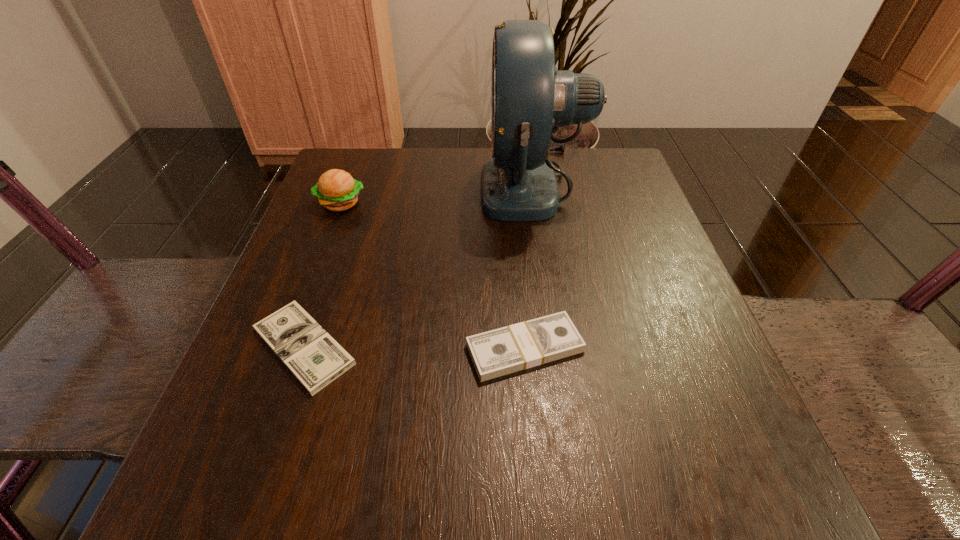
The height and width of the screenshot is (540, 960). I want to click on free region located 0.080m on the left of the right dollar, so click(415, 348).

Locate an element on the screen. Image resolution: width=960 pixels, height=540 pixels. vacant point located on the front of the left dollar is located at coordinates (248, 508).

Image resolution: width=960 pixels, height=540 pixels. What are the coordinates of `fan that is at the far edge` in the screenshot? It's located at (530, 98).

Where is `hamburger located at the far edge`? The height and width of the screenshot is (540, 960). hamburger located at the far edge is located at coordinates (336, 190).

The height and width of the screenshot is (540, 960). What are the coordinates of `hamburger situated at the left edge` in the screenshot? It's located at (336, 190).

The image size is (960, 540). Find the location of `dollar present at the left edge`. dollar present at the left edge is located at coordinates (308, 351).

Identify the location of object situated at the right edge. (530, 98).

This screenshot has width=960, height=540. I want to click on object that is at the far left corner, so click(x=336, y=190).

Locate an element on the screen. This screenshot has width=960, height=540. object situated at the far right corner is located at coordinates (530, 98).

I want to click on free space at the far edge of the desktop, so click(x=424, y=192).